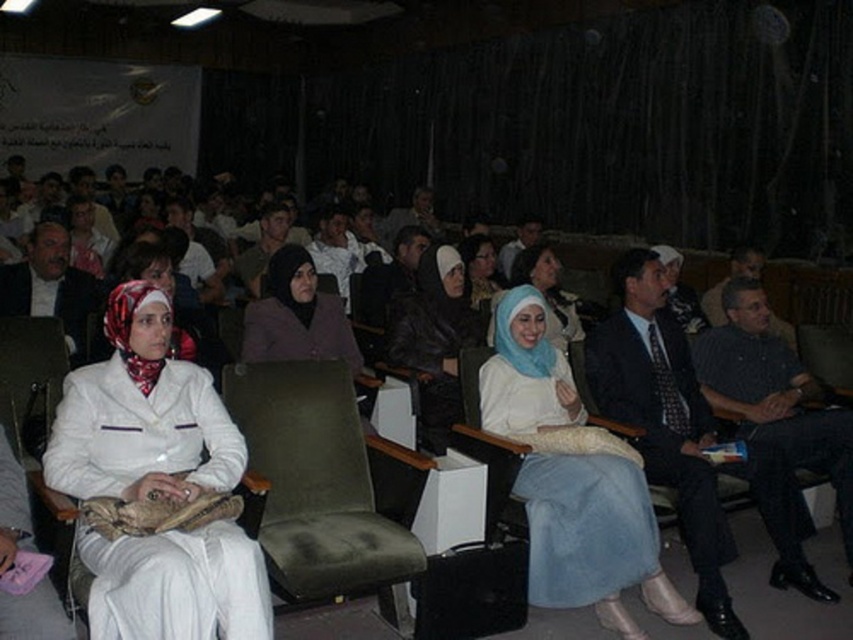
Does light blue satin hijab at center have a larger size compared to dark gray shirt at center?

Actually, light blue satin hijab at center might be smaller than dark gray shirt at center.

Is light blue satin hijab at center thinner than dark gray shirt at center?

Incorrect, light blue satin hijab at center's width is not less than dark gray shirt at center's.

Where is `light blue satin hijab at center`? light blue satin hijab at center is located at coordinates (572, 480).

Between point (280, 556) and point (152, 259), which one is positioned in front?

Point (280, 556)

Between green fabric chair at center and white fabric headscarf at center, which one has less height?

Standing shorter between the two is white fabric headscarf at center.

Where is `green fabric chair at center`? This screenshot has width=853, height=640. green fabric chair at center is located at coordinates (317, 484).

Describe the element at coordinates (775, 396) in the screenshot. This screenshot has width=853, height=640. I see `dark gray shirt at center` at that location.

Measure the distance from dark gray shirt at center to blue fabric hijab at center.

The distance of dark gray shirt at center from blue fabric hijab at center is 4.38 feet.

Find the location of a particular element. This screenshot has width=853, height=640. dark gray shirt at center is located at coordinates (775, 396).